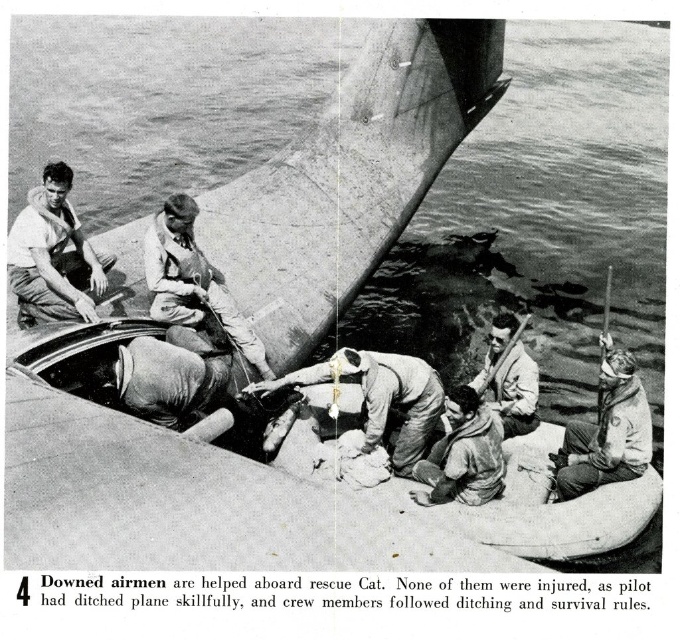
Question: Which point is farther from the camera taking this photo?

Choices:
 (A) (146, 237)
 (B) (469, 420)
 (C) (18, 227)
 (D) (619, 480)

Answer: (A)

Question: Does white fabric life vest at center come in front of light brown fabric sailor at center?

Choices:
 (A) yes
 (B) no

Answer: (A)

Question: Considering the real-world distances, which object is farthest from the smooth white shirt at left?

Choices:
 (A) light gray fabric life vest at lower right
 (B) light gray fabric life vest at center
 (C) light brown fabric sailor at center
 (D) light brown leather rifle at center

Answer: (A)

Question: Which object is the farthest from the white fabric life vest at center?

Choices:
 (A) light brown leather rifle at center
 (B) light gray fabric life vest at center

Answer: (A)

Question: Does white fabric life vest at center have a smaller size compared to light brown leather rifle at center?

Choices:
 (A) yes
 (B) no

Answer: (B)

Question: Is the position of smooth white shirt at left more distant than that of white fabric life vest at center?

Choices:
 (A) no
 (B) yes

Answer: (B)